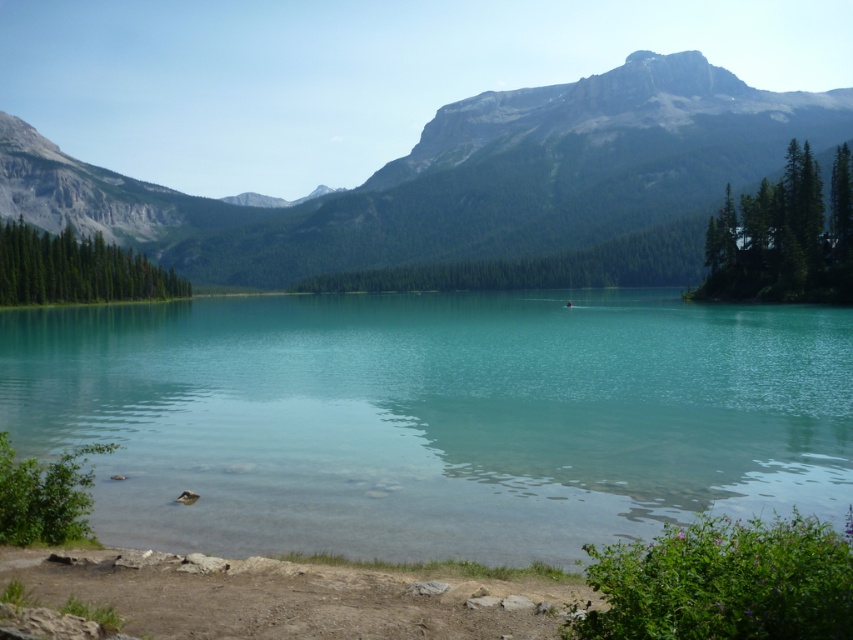
You are standing at the lakeshore and want to reach the green rock mountain at upper center. However, there is a dull brown dirt area in your path. Based on the scene description, can you walk directly to the mountain without going through the dull brown dirt at lower center?

The dull brown dirt at lower center is behind the green rock mountain at upper center, so you can walk directly to the green rock mountain at upper center without going through the dull brown dirt at lower center.

You are standing at the edge of the lake and want to walk towards the green rock mountain at upper center. Which direction should you head relative to the dull brown dirt at lower center?

The green rock mountain at upper center is to the left of the dull brown dirt at lower center, so you should head to the left relative to the dull brown dirt at lower center.

You are planning to build a small boat that is 10 feet long. You want to sail from the clear glass water at center to the green rock mountain at upper center. Can your boat reach the mountain? Please explain your reasoning based on the distance provided.

The distance between the clear glass water at center and the green rock mountain at upper center is 512.88 feet. Since your boat is 10 feet long, it is significantly shorter than the distance required. Therefore, the boat cannot reach the mountain as it would not have enough length to cover the 512.88 feet distance.